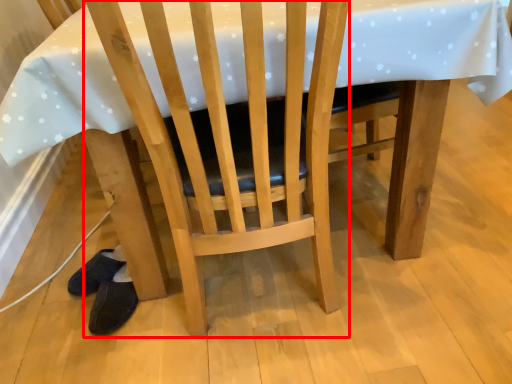
Question: From the image's perspective, what is the correct spatial positioning of chair (annotated by the red box) in reference to footwear?

Choices:
 (A) above
 (B) below

Answer: (A)